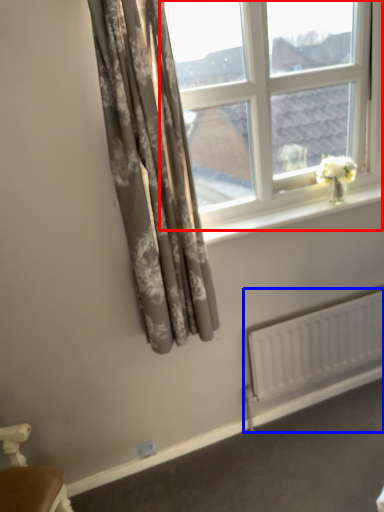
Question: Among these objects, which one is farthest to the camera, window (highlighted by a red box) or radiator (highlighted by a blue box)?

Choices:
 (A) window
 (B) radiator

Answer: (B)